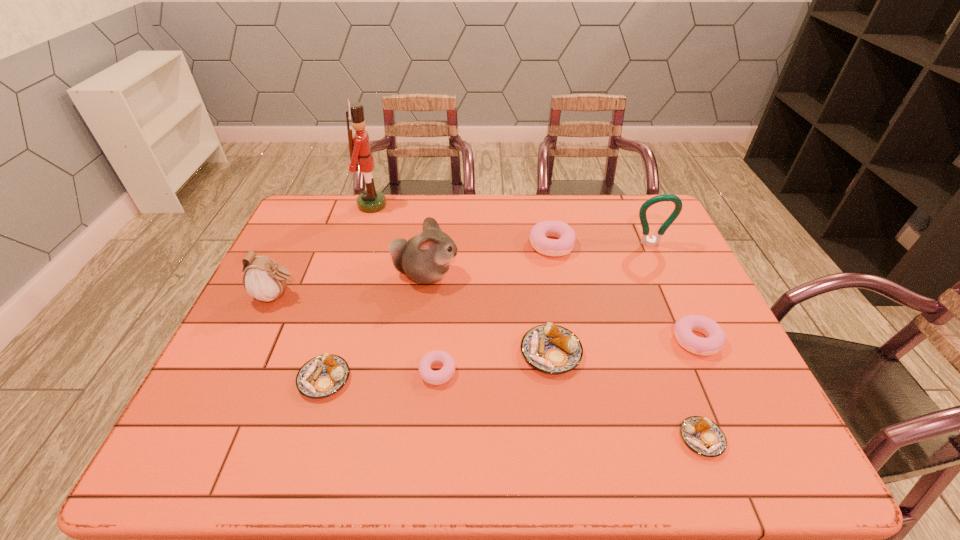
This screenshot has height=540, width=960. I want to click on bottle opener that is at the right edge, so click(x=653, y=241).

Locate an element on the screen. The width and height of the screenshot is (960, 540). object that is at the near right corner is located at coordinates (703, 436).

Identify the location of free spot at the far edge of the desktop. Image resolution: width=960 pixels, height=540 pixels. (456, 217).

This screenshot has height=540, width=960. Identify the location of vacant point at the near edge. (501, 461).

This screenshot has height=540, width=960. I want to click on vacant position at the left edge of the desktop, so click(x=291, y=292).

In the image, there is a desktop. Where is `free space at the right edge`? This screenshot has width=960, height=540. free space at the right edge is located at coordinates (707, 375).

At what (x,y) coordinates should I click in order to perform the action: click on vacant space at the far left corner of the desktop. Please return your answer as a coordinate pair (x, y). The height and width of the screenshot is (540, 960). Looking at the image, I should click on tap(328, 219).

What are the coordinates of `vacant space at the near left corner of the desktop` in the screenshot? It's located at (197, 449).

The image size is (960, 540). I want to click on vacant space at the far right corner of the desktop, so click(x=631, y=195).

Locate an element on the screen. The height and width of the screenshot is (540, 960). vacant area that lies between the biggest brown pastry and the white hamster is located at coordinates (489, 313).